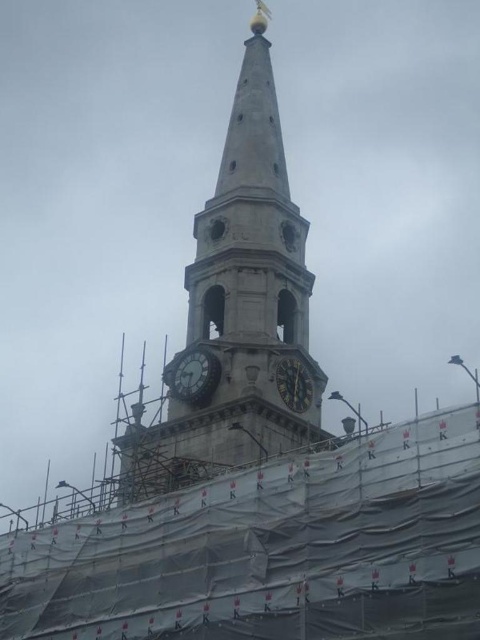
Who is lower down, stone clock tower at center or gold textured clock at center?

gold textured clock at center is below.

Does stone clock tower at center have a larger size compared to gold textured clock at center?

Yes, stone clock tower at center is bigger than gold textured clock at center.

You are a GUI agent. You are given a task and a screenshot of the screen. Output one action in this format:
    pyautogui.click(x=<x>, y=<y>)
    Task: Click on the stone clock tower at center
    
    Given the screenshot: What is the action you would take?
    pyautogui.click(x=238, y=307)

Which is behind, point (206, 378) or point (288, 371)?

Point (288, 371)

Does dark gray stone clock at center lie behind gold textured clock at center?

Yes, it is behind gold textured clock at center.

Where is `dark gray stone clock at center`? dark gray stone clock at center is located at coordinates (192, 376).

Between stone clock tower at center and dark gray stone clock at center, which one is positioned lower?

dark gray stone clock at center is below.

Locate an element on the screen. stone clock tower at center is located at coordinates (238, 307).